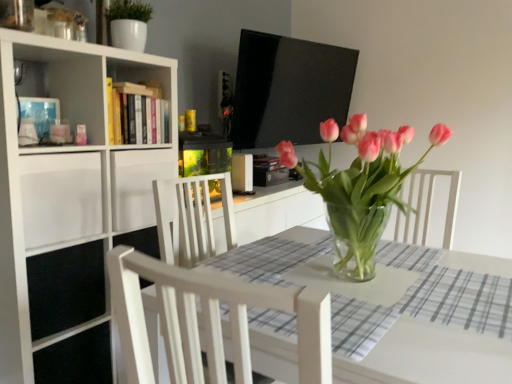
What are the coordinates of `vacant region under pink glass vase at center (from a real-world perspective)` in the screenshot? It's located at (362, 283).